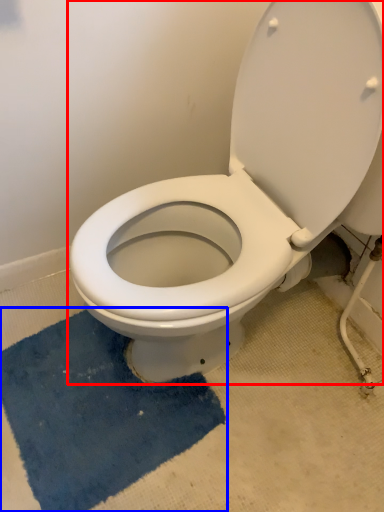
Question: Among these objects, which one is nearest to the camera, toilet (highlighted by a red box) or bath mat (highlighted by a blue box)?

Choices:
 (A) toilet
 (B) bath mat

Answer: (A)